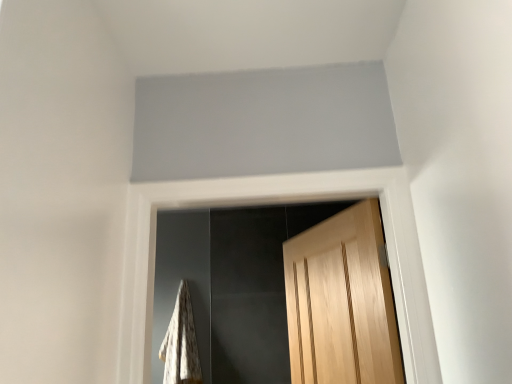
Question: Is white textured blanket at lower left positioned before light brown wood door at center?

Choices:
 (A) yes
 (B) no

Answer: (B)

Question: Is white textured blanket at lower left looking in the opposite direction of light brown wood door at center?

Choices:
 (A) no
 (B) yes

Answer: (A)

Question: Could you tell me if white textured blanket at lower left is facing light brown wood door at center?

Choices:
 (A) yes
 (B) no

Answer: (B)

Question: Is white textured blanket at lower left at the right side of light brown wood door at center?

Choices:
 (A) yes
 (B) no

Answer: (B)

Question: Would you say white textured blanket at lower left is a long distance from light brown wood door at center?

Choices:
 (A) yes
 (B) no

Answer: (A)

Question: From a real-world perspective, is white textured blanket at lower left on top of light brown wood door at center?

Choices:
 (A) yes
 (B) no

Answer: (B)

Question: Can you confirm if light brown wood door at center is bigger than white textured blanket at lower left?

Choices:
 (A) no
 (B) yes

Answer: (B)

Question: Is light brown wood door at center wider than white textured blanket at lower left?

Choices:
 (A) no
 (B) yes

Answer: (A)

Question: Is light brown wood door at center facing away from white textured blanket at lower left?

Choices:
 (A) yes
 (B) no

Answer: (B)

Question: From the image's perspective, does light brown wood door at center appear lower than white textured blanket at lower left?

Choices:
 (A) yes
 (B) no

Answer: (B)

Question: Is light brown wood door at center positioned in front of white textured blanket at lower left?

Choices:
 (A) yes
 (B) no

Answer: (A)

Question: Does light brown wood door at center appear on the right side of white textured blanket at lower left?

Choices:
 (A) yes
 (B) no

Answer: (A)

Question: Choose the correct answer: Is light brown wood door at center inside white textured blanket at lower left or outside it?

Choices:
 (A) outside
 (B) inside

Answer: (A)